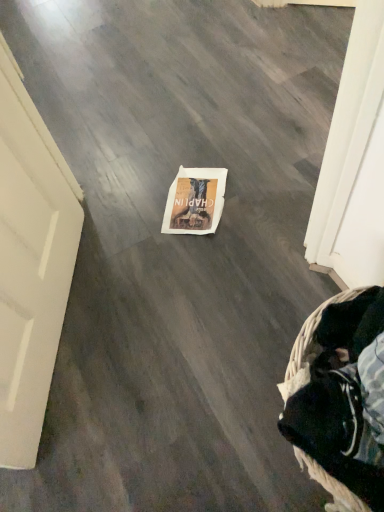
The width and height of the screenshot is (384, 512). Identify the location of woven fabric basket at lower right. (340, 397).

Describe the element at coordinates (340, 397) in the screenshot. This screenshot has width=384, height=512. I see `woven fabric basket at lower right` at that location.

What are the coordinates of `woven fabric basket at lower right` in the screenshot? It's located at (340, 397).